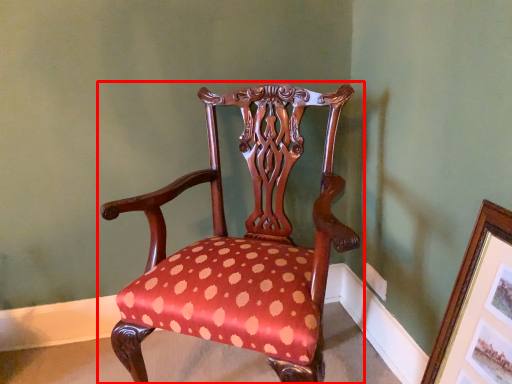
Question: From the image's perspective, where is chair (annotated by the red box) located in relation to picture frame in the image?

Choices:
 (A) above
 (B) below

Answer: (A)